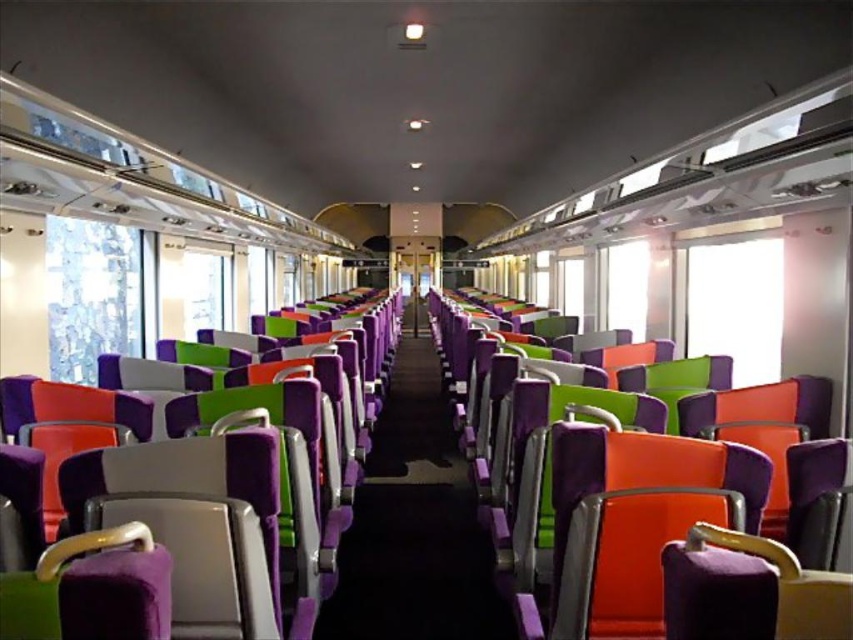
Can you confirm if purple fabric seat at left is thinner than purple fabric seat at center?

Indeed, purple fabric seat at left has a lesser width compared to purple fabric seat at center.

Does purple fabric seat at left lie in front of purple fabric seat at center?

Yes.

This screenshot has width=853, height=640. What do you see at coordinates (170, 541) in the screenshot?
I see `purple fabric seat at left` at bounding box center [170, 541].

Where is `purple fabric seat at left`? The height and width of the screenshot is (640, 853). purple fabric seat at left is located at coordinates (170, 541).